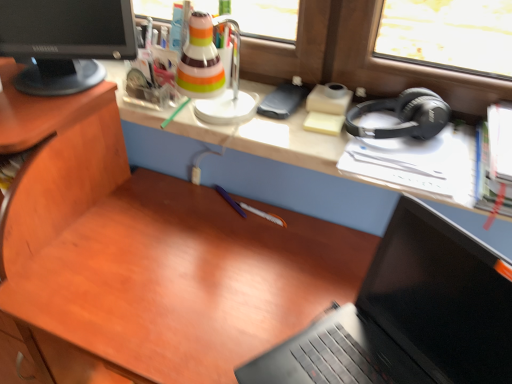
Question: Is black matte laptop at lower right at the left side of black matte headphones at right?

Choices:
 (A) no
 (B) yes

Answer: (B)

Question: Is black matte laptop at lower right facing towards black matte headphones at right?

Choices:
 (A) yes
 (B) no

Answer: (B)

Question: From the image's perspective, would you say black matte laptop at lower right is shown under black matte headphones at right?

Choices:
 (A) no
 (B) yes

Answer: (B)

Question: Is black matte laptop at lower right next to black matte headphones at right?

Choices:
 (A) no
 (B) yes

Answer: (A)

Question: Could black matte headphones at right be considered to be inside black matte laptop at lower right?

Choices:
 (A) no
 (B) yes

Answer: (A)

Question: From a real-world perspective, is black glossy computer monitor at upper left above or below black matte headphones at right?

Choices:
 (A) below
 (B) above

Answer: (B)

Question: Is black glossy computer monitor at upper left situated inside black matte headphones at right or outside?

Choices:
 (A) inside
 (B) outside

Answer: (B)

Question: Is black glossy computer monitor at upper left taller or shorter than black matte headphones at right?

Choices:
 (A) short
 (B) tall

Answer: (B)

Question: Looking at the image, does black glossy computer monitor at upper left seem bigger or smaller compared to black matte headphones at right?

Choices:
 (A) big
 (B) small

Answer: (A)

Question: From a real-world perspective, is black matte headphones at right positioned above or below black matte laptop at lower right?

Choices:
 (A) above
 (B) below

Answer: (A)

Question: In the image, is black matte headphones at right positioned in front of or behind black matte laptop at lower right?

Choices:
 (A) behind
 (B) front

Answer: (A)

Question: Looking at the image, does black matte headphones at right seem bigger or smaller compared to black matte laptop at lower right?

Choices:
 (A) big
 (B) small

Answer: (B)

Question: Is black matte headphones at right inside or outside of black matte laptop at lower right?

Choices:
 (A) outside
 (B) inside

Answer: (A)

Question: From a real-world perspective, is black matte laptop at lower right physically located above or below black matte headphones at right?

Choices:
 (A) above
 (B) below

Answer: (B)

Question: Based on their positions, is black matte laptop at lower right located to the left or right of black matte headphones at right?

Choices:
 (A) left
 (B) right

Answer: (A)